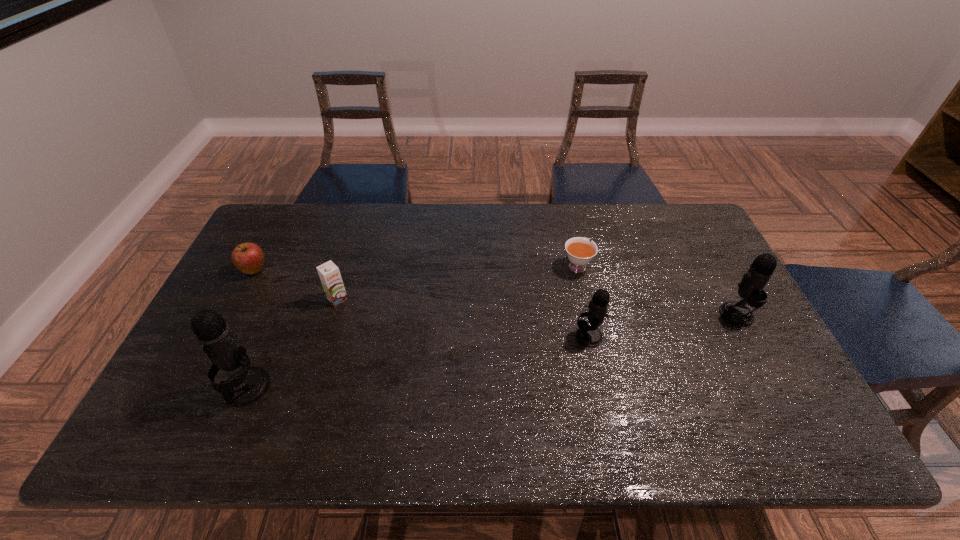
Where is `microphone that is the second closest one to the teacup`? The image size is (960, 540). microphone that is the second closest one to the teacup is located at coordinates (751, 287).

Point out which microphone is positioned as the second nearest to the second shortest microphone. Please provide its 2D coordinates. Your answer should be formatted as a tuple, i.e. [(x, y)], where the tuple contains the x and y coordinates of a point satisfying the conditions above.

[(247, 385)]